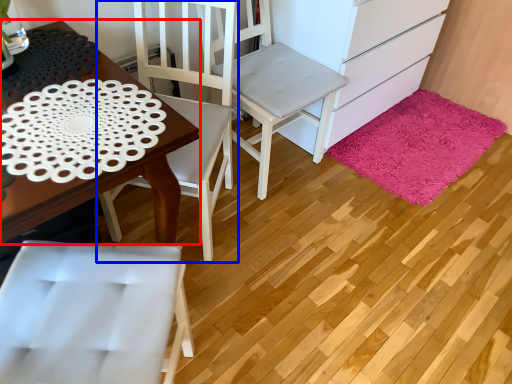
Question: Among these objects, which one is farthest to the camera, desk (highlighted by a red box) or chair (highlighted by a blue box)?

Choices:
 (A) desk
 (B) chair

Answer: (B)